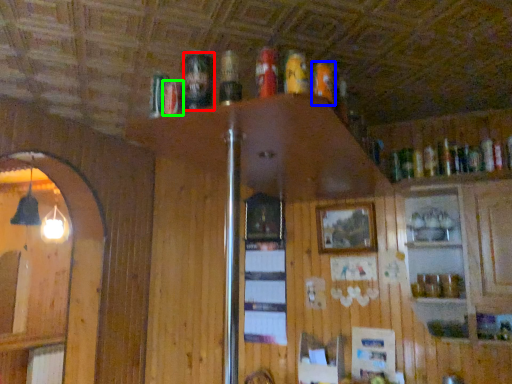
Question: Which object is positioned closest to beer (highlighted by a red box)? Select from beer (highlighted by a blue box) and beer (highlighted by a green box).

Choices:
 (A) beer
 (B) beer

Answer: (B)